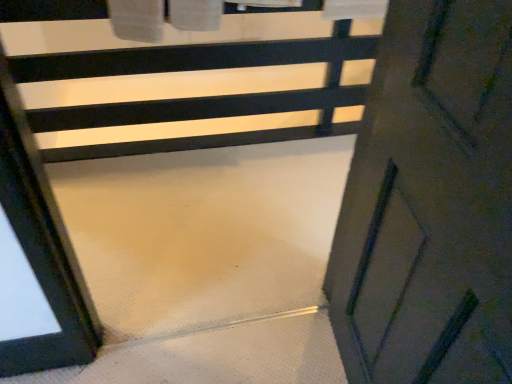
Locate an element on the screen. The width and height of the screenshot is (512, 384). free space behind white matte stair at center is located at coordinates (226, 244).